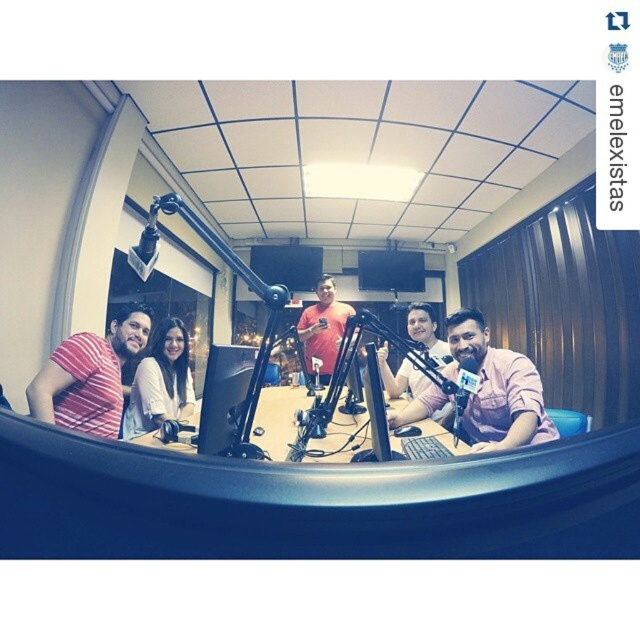
Consider the image. You are a photographer adjusting your camera to focus on two specific points in the scene. The first point is at coordinates point (540, 458) and the second is at point (140, 372). Which point should you focus on first if you want to capture the closest object to the camera?

Point (540, 458) is closer to the camera than point (140, 372), so you should focus on point (540, 458) first to capture the closest object.

You are a sound engineer setting up a microphone in the studio. You have two points marked on the floor where equipment needs to be placed. The first point is at coordinates point (516,403) and the second at point (317,342). According to the studio layout, which point is closer to the camera?

Point (516,403) is in front of point (317,342), so it is closer to the camera.

You are a photographer positioned in front of the radio studio setup. You want to capture a closeup shot of the pink matte shirt at center without moving the camera. Is the current distance sufficient for a clear closeup?

The pink matte shirt at center is 1.28 meters away from the viewer, so if the camera has a zoom lens capable of focusing at that distance, a clear closeup is possible without moving the camera.